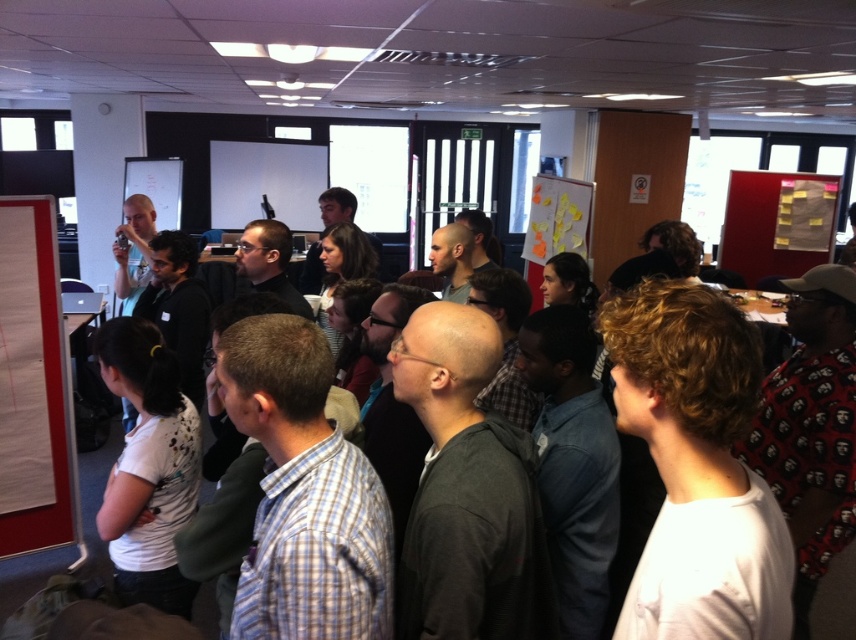
In the scene shown: You are a photographer standing in the room and want to take a picture of the white matte shirt at lower left and the white paper at left. Which object should you focus on first if you want to capture both in one shot without moving the camera?

The white matte shirt at lower left might be wider than the white paper at left, so you should focus on the white matte shirt at lower left first to ensure it is in frame and properly captured.

Based on the scene description, where exactly is the white matte shirt at lower left located in terms of coordinates?

The white matte shirt at lower left is located at coordinates point [147,467].